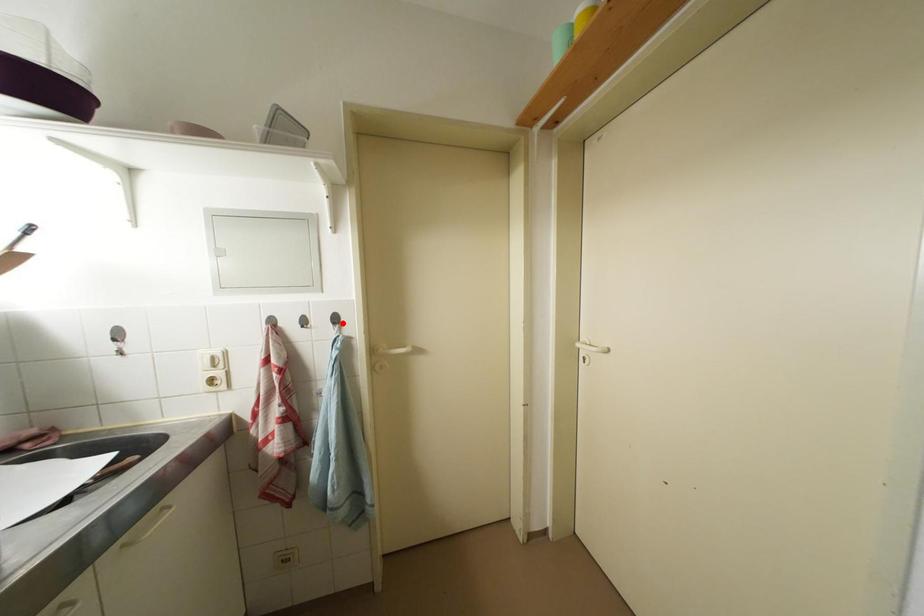
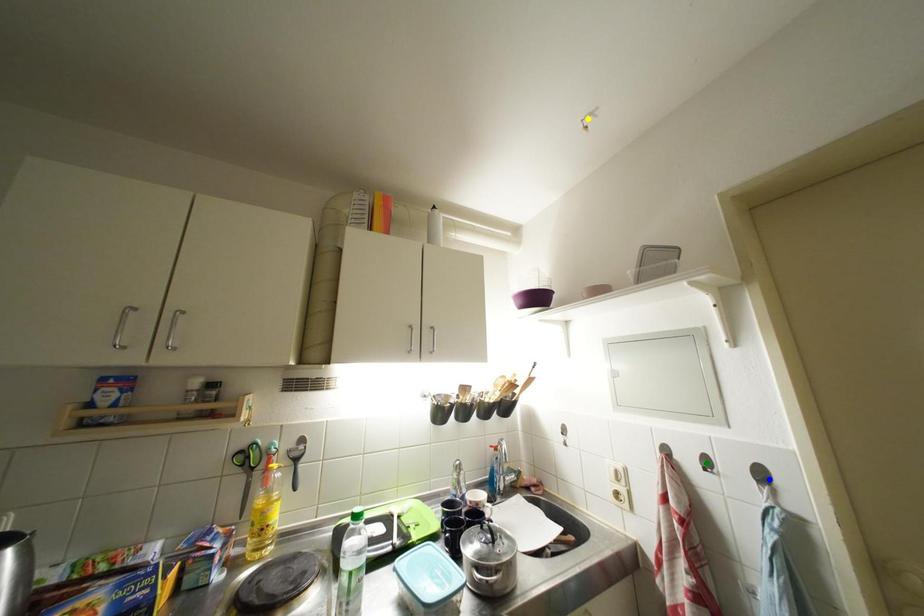
Question: I am providing you with two images of the same scene from different viewpoints. A red point is marked on the first image. You are given multiple points on the second image. Which spot in image 2 lines up with the point in image 1?

Choices:
 (A) blue point
 (B) green point
 (C) yellow point

Answer: (A)